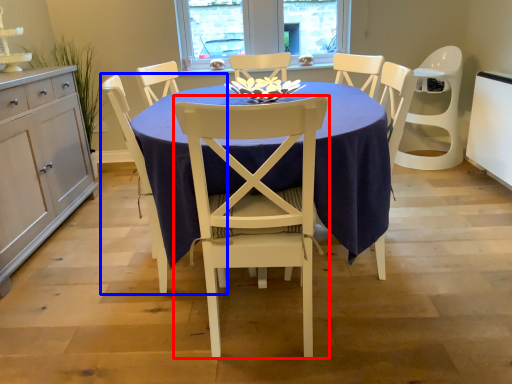
Question: Which object is closer to the camera taking this photo, chair (highlighted by a red box) or chair (highlighted by a blue box)?

Choices:
 (A) chair
 (B) chair

Answer: (A)